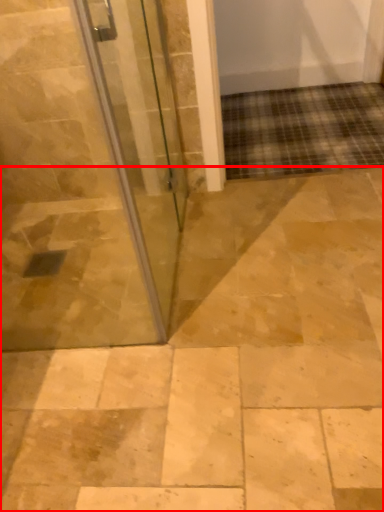
Question: Considering the relative positions of path (annotated by the red box) and door in the image provided, where is path (annotated by the red box) located with respect to the staircase?

Choices:
 (A) left
 (B) right

Answer: (B)